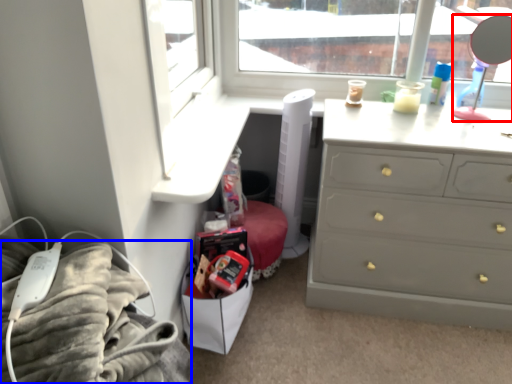
Question: Among these objects, which one is farthest to the camera, mirror (highlighted by a red box) or bedding (highlighted by a blue box)?

Choices:
 (A) mirror
 (B) bedding

Answer: (A)